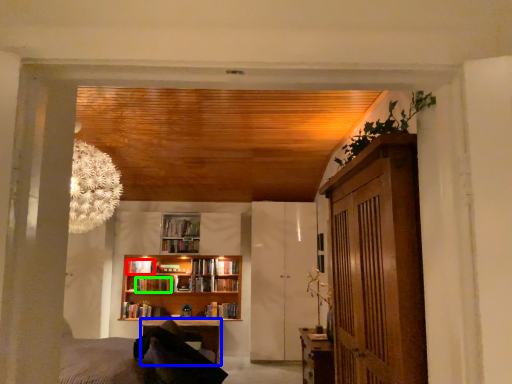
Question: Estimate the real-world distances between objects in this image. Which object is farther from book (highlighted by a red box), table (highlighted by a blue box) or book (highlighted by a green box)?

Choices:
 (A) table
 (B) book

Answer: (A)